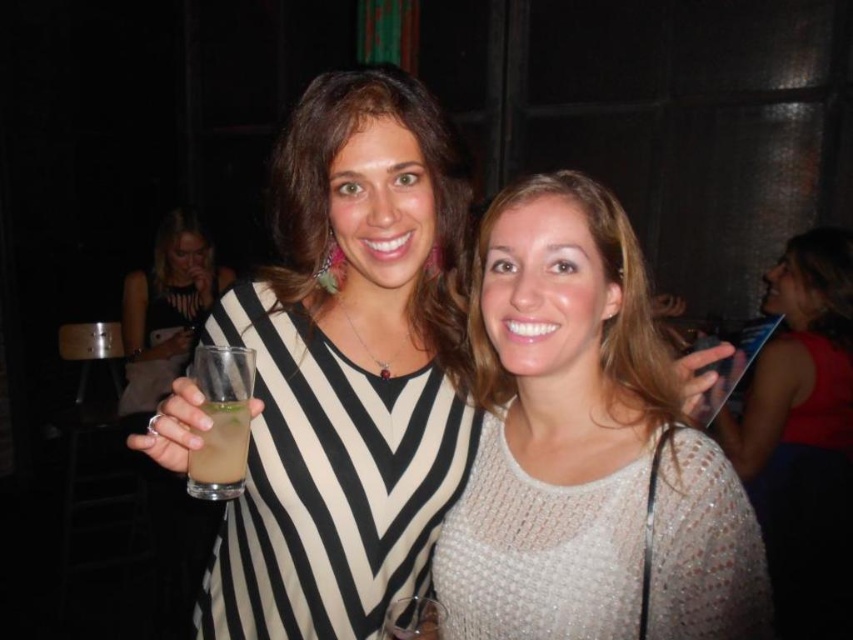
Can you confirm if white textured sweater at right is positioned to the left of clear glass wine glass at center?

Incorrect, white textured sweater at right is not on the left side of clear glass wine glass at center.

Does white textured sweater at right lie in front of clear glass wine glass at center?

No, it is not.

Is point (805, 232) positioned before point (407, 634)?

No.

Image resolution: width=853 pixels, height=640 pixels. I want to click on white textured sweater at right, so pyautogui.click(x=804, y=436).

Is clear plastic cup at center thinner than clear glass wine glass at center?

Incorrect, clear plastic cup at center's width is not less than clear glass wine glass at center's.

Is point (178, 353) positioned in front of point (421, 604)?

No, it is not.

Describe the element at coordinates (166, 308) in the screenshot. I see `clear plastic cup at center` at that location.

Locate an element on the screen. The width and height of the screenshot is (853, 640). clear plastic cup at center is located at coordinates (166, 308).

Does black and white striped dress at center have a larger size compared to clear plastic glass at left?

Yes, black and white striped dress at center is bigger than clear plastic glass at left.

Does black and white striped dress at center appear under clear plastic glass at left?

Incorrect, black and white striped dress at center is not positioned below clear plastic glass at left.

You are a GUI agent. You are given a task and a screenshot of the screen. Output one action in this format:
    pyautogui.click(x=<x>, y=<y>)
    Task: Click on the black and white striped dress at center
    The width and height of the screenshot is (853, 640).
    Given the screenshot: What is the action you would take?
    pyautogui.click(x=347, y=369)